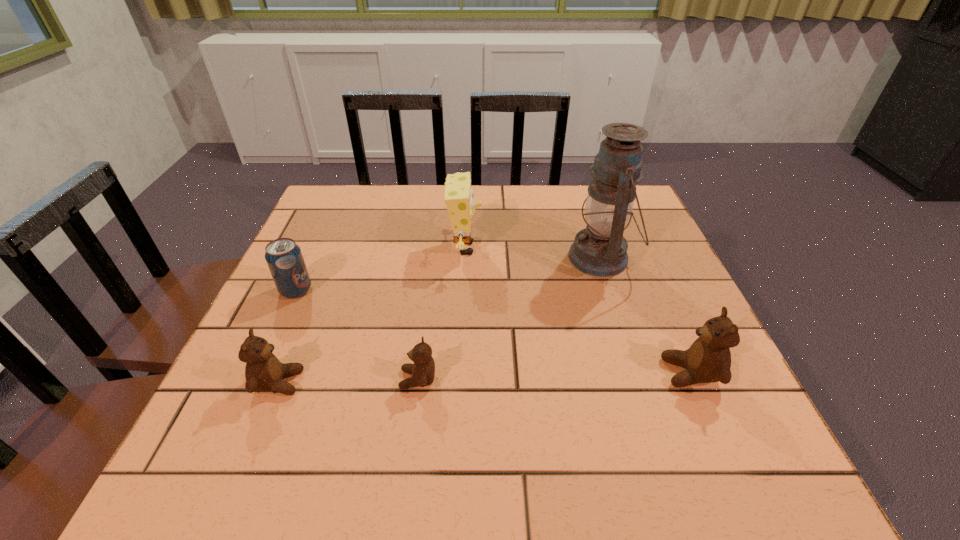
Locate an element on the screen. This screenshot has height=540, width=960. free location that satisfies the following two spatial constraints: 1. on the front side of the tallest object; 2. at the face of the shortest teddy bear is located at coordinates (641, 379).